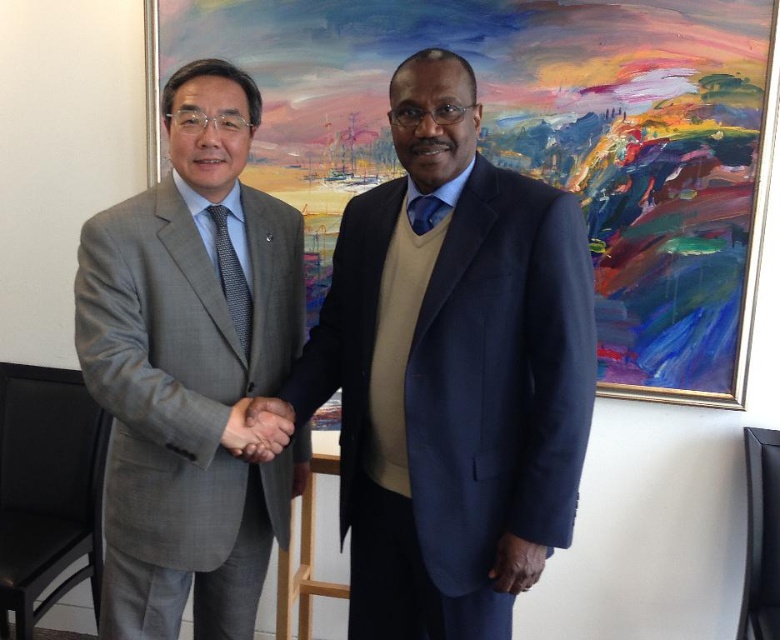
You are a photographer taking a picture of the scene. You need to adjust your camera to focus on the oil painting at upper center and the dark brown leather hand at center. Which object is located to the left of the other?

The oil painting at upper center is positioned on the left side of dark brown leather hand at center.

You are a photographer setting up a shot of the two men shaking hands. You want to ensure the oil painting at upper center and the dark brown leather hand at center are both in the frame. Based on their sizes, which object should appear larger in your photo?

The oil painting at upper center is taller than the dark brown leather hand at center, so it should appear larger in the photo.

Consider the image. You are an interior designer analyzing the spatial layout of the room. The matte blue suit at center is positioned at coordinates 0.578, 0.579. How does this placement affect the visual balance of the room?

The placement of the matte blue suit at center at coordinates (451, 369) contributes to the visual balance by positioning it near the center of the room, which typically creates a harmonious and balanced composition.